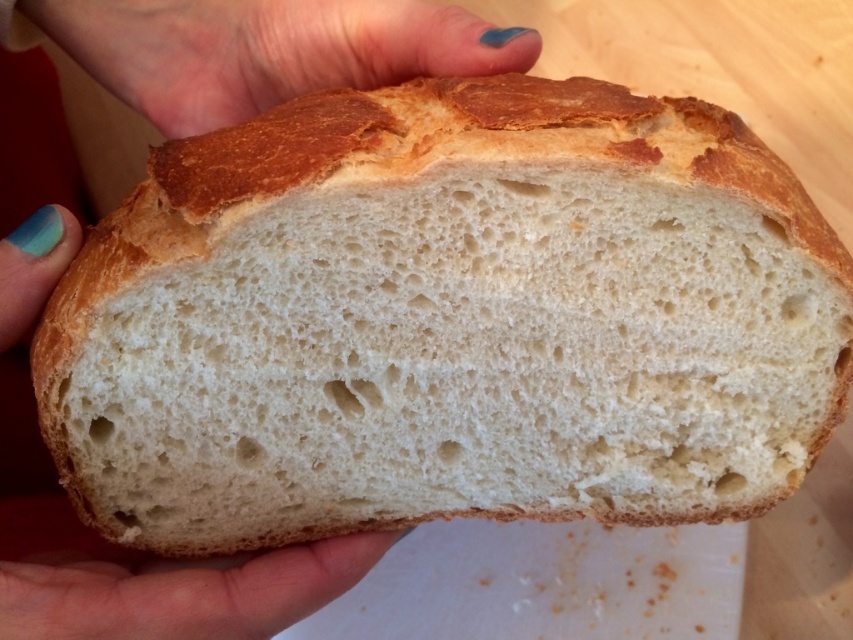
You are a baker who wants to place both the golden brown crusty bread at center and the teal nail polish at upper center onto a small shelf. The shelf can only hold items where the larger item is placed first. Which item should you place first?

The golden brown crusty bread at center is bigger than the teal nail polish at upper center, so you should place the golden brown crusty bread at center first to ensure stability.